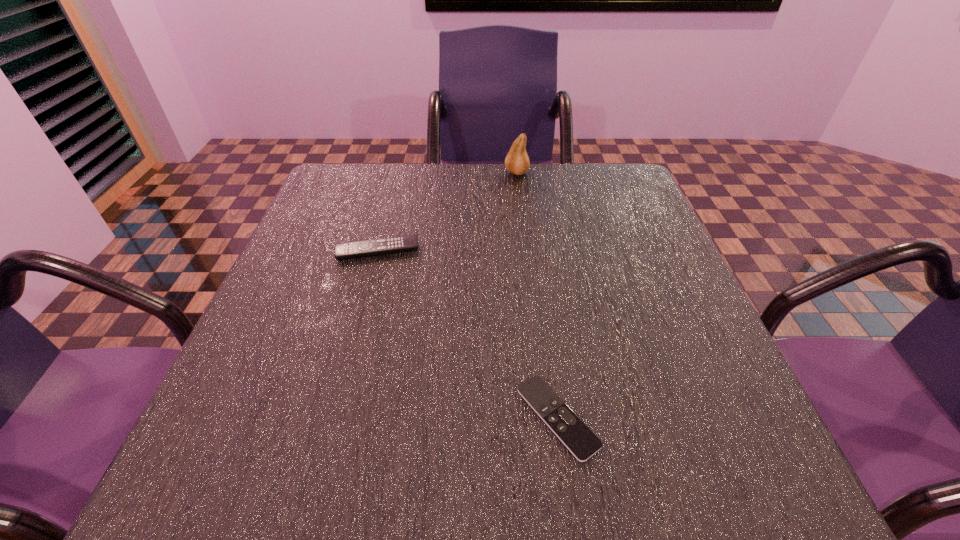
Identify the location of free location that satisfies the following two spatial constraints: 1. on the front side of the nearer remote control; 2. on the left side of the pear. The height and width of the screenshot is (540, 960). (545, 417).

The width and height of the screenshot is (960, 540). What are the coordinates of `vacant space that satisfies the following two spatial constraints: 1. on the front side of the pear; 2. on the right side of the nearest object` in the screenshot? It's located at (545, 417).

Image resolution: width=960 pixels, height=540 pixels. Identify the location of free space that satisfies the following two spatial constraints: 1. on the front side of the second nearest object; 2. on the left side of the right remote control. (333, 417).